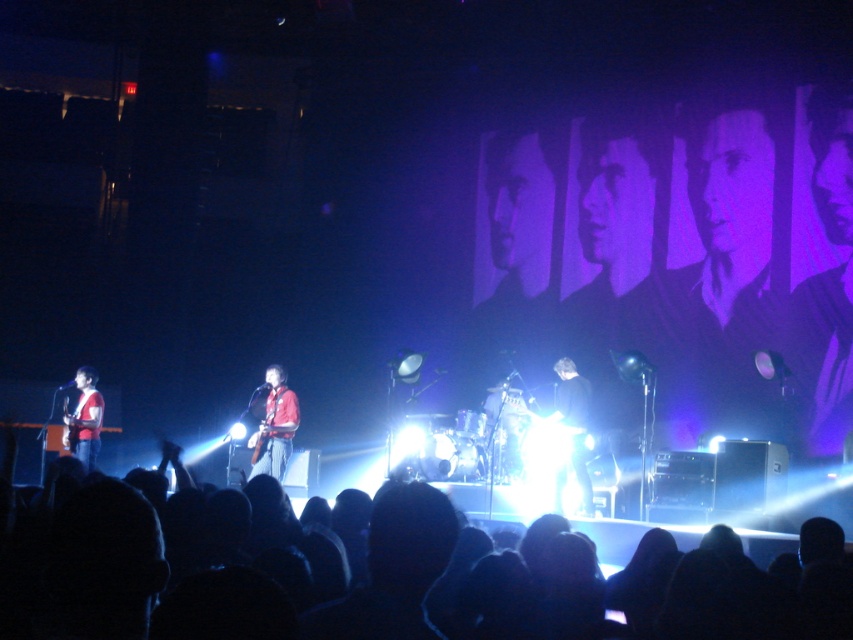
You are a photographer trying to capture a clear shot of the matte red shirt at left during the concert. However, the black fabric crowd at lower center is blocking your view. Can you estimate whether the crowd is bigger or smaller than the shirt in the image?

The black fabric crowd at lower center has a larger size compared to matte red shirt at left, so the crowd is bigger than the shirt in the image.

You are a photographer standing at the back of the venue. You want to take a photo of the red fabric guitar at center without the black fabric crowd at lower center appearing in the foreground. What should you do?

The black fabric crowd at lower center is 5.50 meters away from the red fabric guitar at center. To avoid the crowd in the foreground, you should move closer to the stage so that the distance between you and the guitar is less than 5.50 meters, ensuring the crowd is out of the frame.